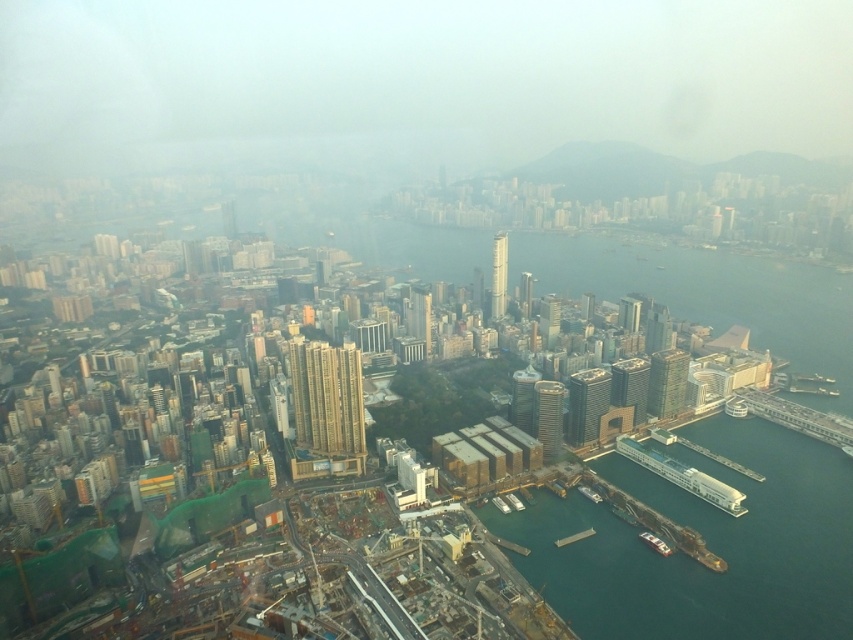
You are a pilot preparing to land a small aircraft at the airport near the white fog at center and the metallic gray boat at lower right. Which object would block your view more if you approach from the north?

The white fog at center would block your view more than the metallic gray boat at lower right because it is larger in size according to the description.

You are a drone operator flying over the city. Your drone is currently at the white fog at center. You need to fly towards the nearest building. Which direction should you fly to reach the nearest building?

The white fog at center is located at point (415, 81). Since the nearest building would be in the direction of the city skyline, which is typically at the top of the image in an aerial view, the drone should fly upwards to reach the nearest building.

Based on the scene description, what is located at the coordinates point (x=415, y=81)?

The point (x=415, y=81) corresponds to white fog at center.